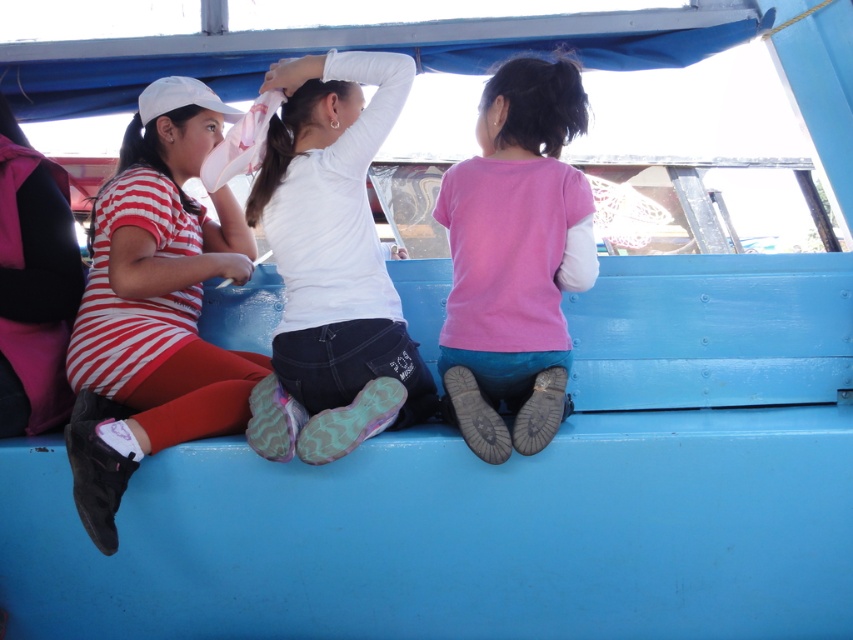
Question: Is striped fabric dress at left positioned at the back of pink matte shirt at center?

Choices:
 (A) no
 (B) yes

Answer: (A)

Question: Which object is positioned closest to the pink matte shirt at center?

Choices:
 (A) white matte shirt at center
 (B) striped fabric dress at left

Answer: (A)

Question: Estimate the real-world distances between objects in this image. Which object is closer to the white matte shirt at center?

Choices:
 (A) pink matte shirt at center
 (B) striped fabric dress at left

Answer: (A)

Question: Is striped fabric dress at left to the left of white matte shirt at center from the viewer's perspective?

Choices:
 (A) yes
 (B) no

Answer: (A)

Question: Which point is farther to the camera?

Choices:
 (A) (93, 378)
 (B) (281, 124)
 (C) (543, 104)

Answer: (B)

Question: Can you confirm if striped fabric dress at left is positioned to the left of pink matte shirt at center?

Choices:
 (A) yes
 (B) no

Answer: (A)